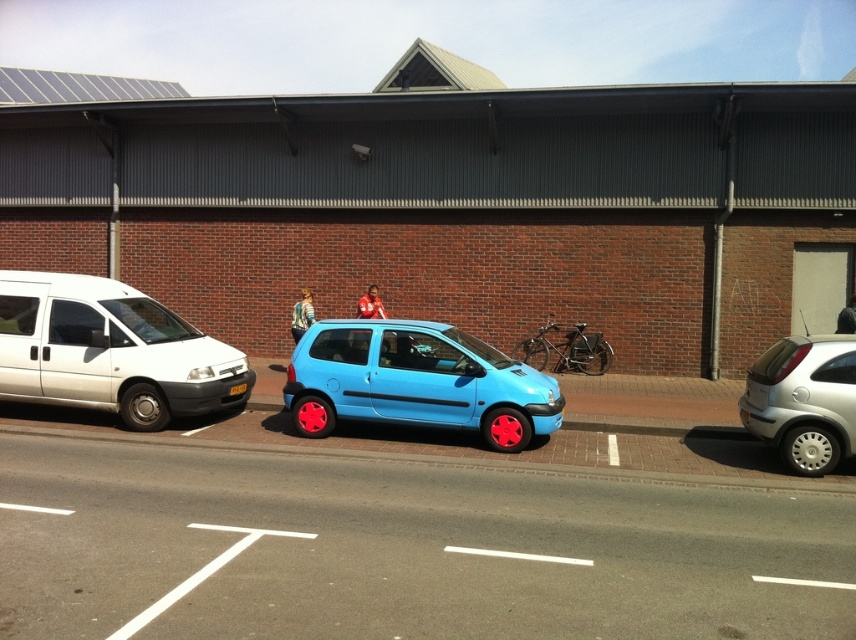
Question: Does matte blue hatchback at center appear on the right side of silver metallic hatchback at right?

Choices:
 (A) yes
 (B) no

Answer: (B)

Question: Does white matte van at left appear under black plastic license plate at center?

Choices:
 (A) yes
 (B) no

Answer: (B)

Question: Which object is farther from the camera taking this photo?

Choices:
 (A) matte blue hatchback at center
 (B) black plastic license plate at center

Answer: (B)

Question: Considering the real-world distances, which object is closest to the black plastic license plate at center?

Choices:
 (A) white matte van at left
 (B) matte blue hatchback at center

Answer: (A)

Question: Is matte blue hatchback at center below silver metallic hatchback at right?

Choices:
 (A) no
 (B) yes

Answer: (B)

Question: Which of the following is the farthest from the observer?

Choices:
 (A) white matte van at left
 (B) matte blue hatchback at center

Answer: (A)